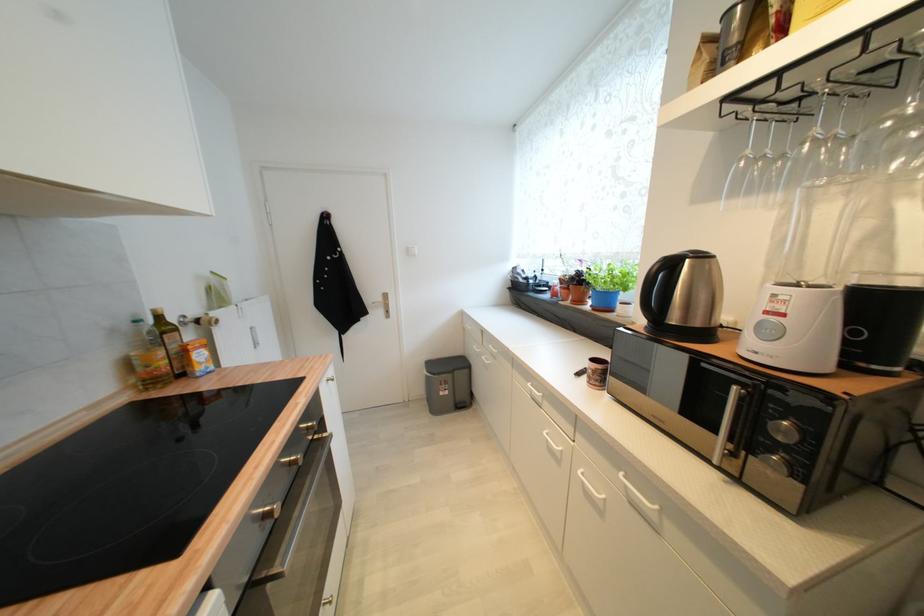
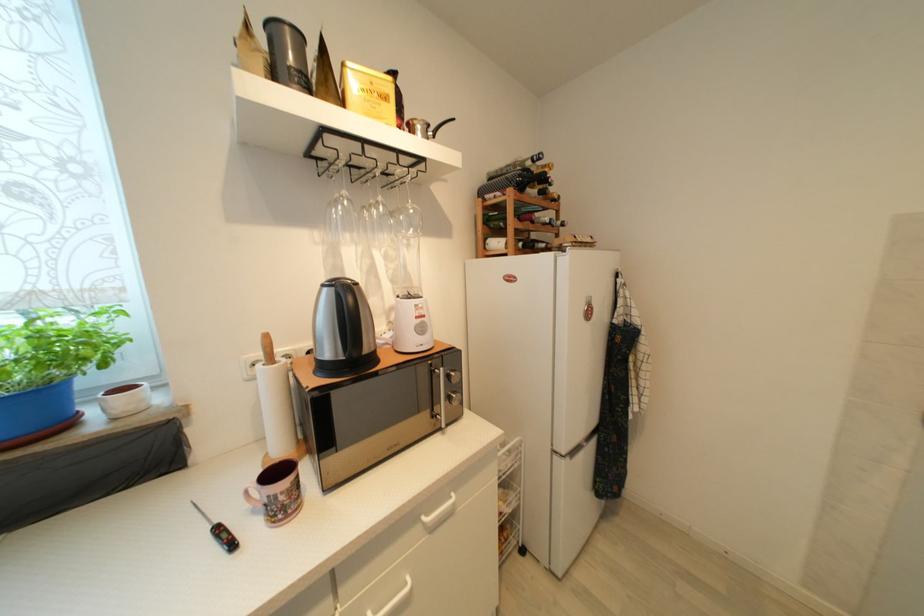
Question: How did the camera likely rotate?

Choices:
 (A) Left
 (B) Right
 (C) Up
 (D) Down

Answer: (B)